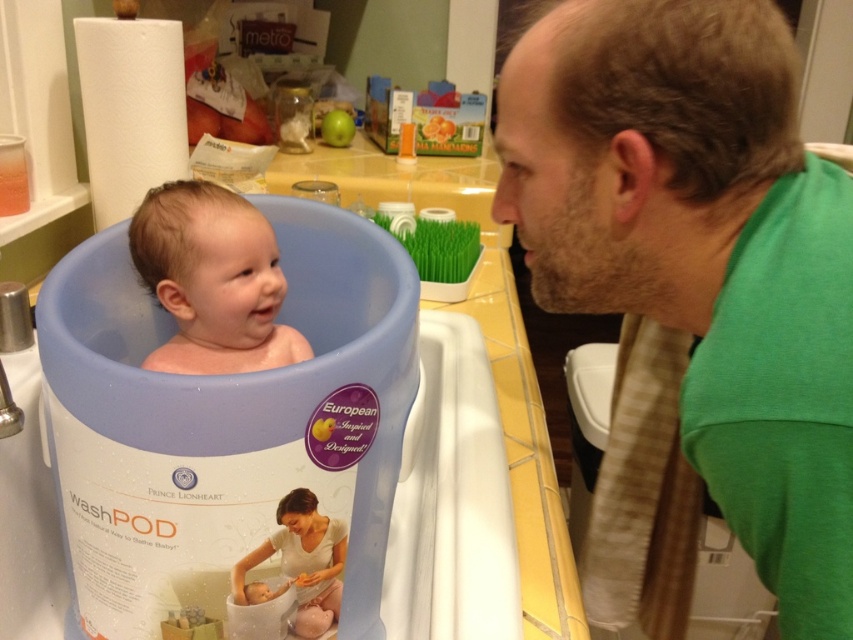
You are a photographer taking a picture of the bathroom scene. You need to ensure that both the green fabric shirt at upper right and the smooth plastic baby in tub at left are clearly visible. Which object should you focus on first if you want to capture both in sharp detail?

The green fabric shirt at upper right is larger in size than the smooth plastic baby in tub at left, so you should focus on the green fabric shirt at upper right first to ensure it is in sharp detail before adjusting for the smaller baby.

You are a photographer trying to capture the green fabric shirt at upper right in the bathroom scene. What are the coordinates where you should focus your camera?

The coordinates to focus on are point (671, 262).

You are a parent trying to decide which item to hand to the baby first. Since the green fabric shirt at upper right and the soft white fabric baby at center are both within reach, which one is larger and should be chosen for safety?

The green fabric shirt at upper right is bigger than the soft white fabric baby at center, so it should be chosen for safety.